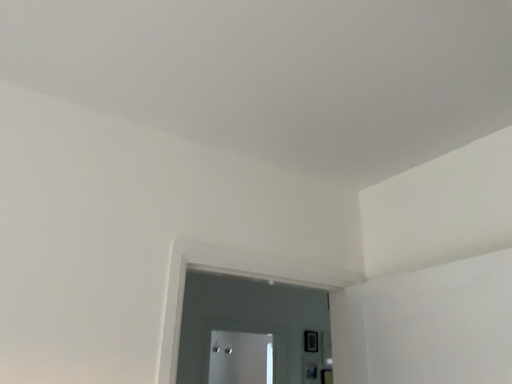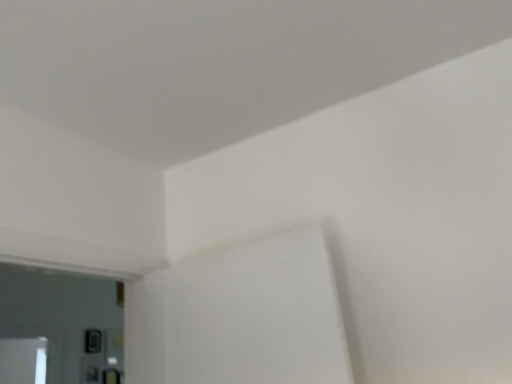
Question: Which way did the camera rotate in the video?

Choices:
 (A) rotated left
 (B) rotated right

Answer: (B)